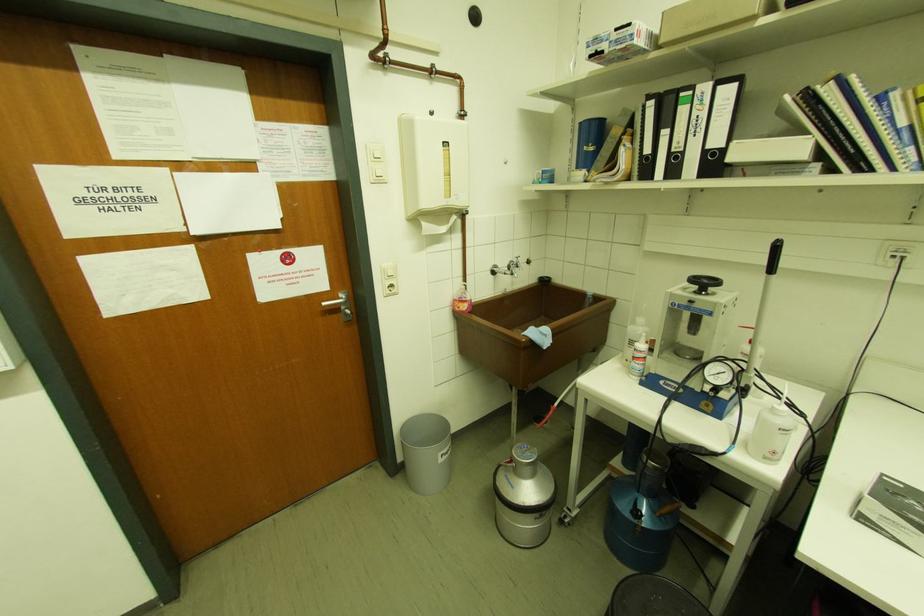
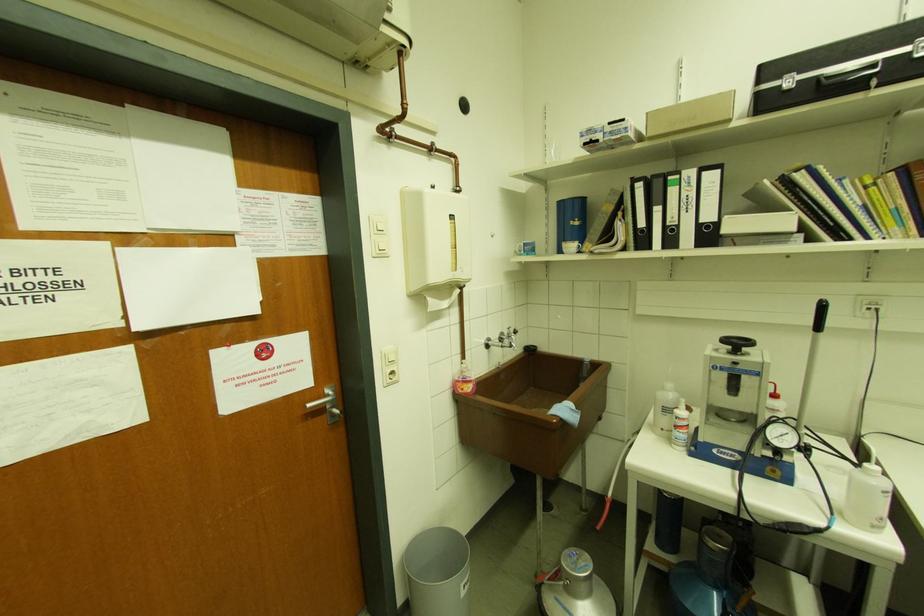
Find the pixel in the second image that matches the point at 444,461 in the first image.

(467, 594)